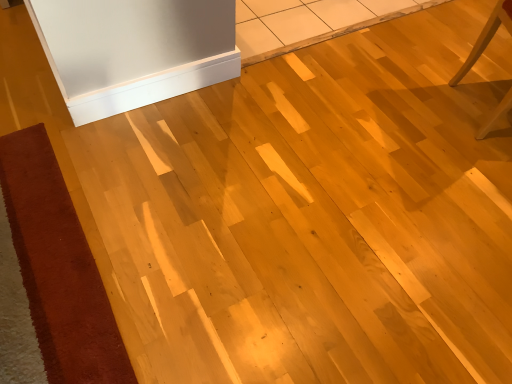
At what (x,y) coordinates should I click in order to perform the action: click on vacant space in front of white glossy baseboard at upper center. Please return your answer as a coordinate pair (x, y). The height and width of the screenshot is (384, 512). Looking at the image, I should click on (129, 188).